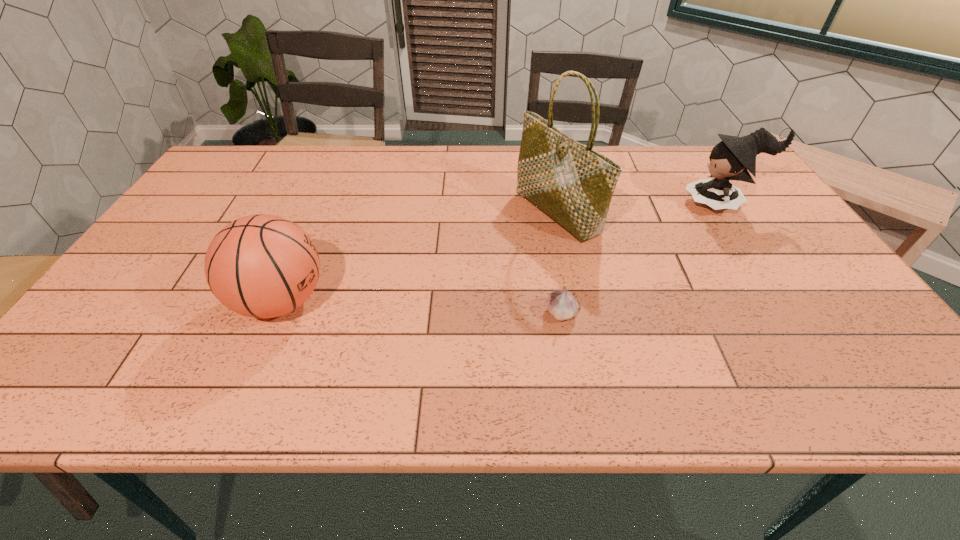
The height and width of the screenshot is (540, 960). Find the location of `free space between the shortest object and the tallest object`. free space between the shortest object and the tallest object is located at coordinates (559, 262).

This screenshot has width=960, height=540. Find the location of `free spot between the shopping bag and the doll`. free spot between the shopping bag and the doll is located at coordinates (639, 208).

This screenshot has height=540, width=960. Identify the location of vacant area that lies between the shortest object and the leftmost object. (421, 307).

Locate an element on the screen. free space between the tallest object and the doll is located at coordinates click(x=639, y=208).

I want to click on free space between the shopping bag and the basketball, so click(419, 257).

Where is `object that stands as the third closest to the rightmost object`? object that stands as the third closest to the rightmost object is located at coordinates (262, 266).

Where is `the second closest object to the shopping bag`? The image size is (960, 540). the second closest object to the shopping bag is located at coordinates point(731,159).

The width and height of the screenshot is (960, 540). I want to click on free space that satisfies the following two spatial constraints: 1. on the surface of the garlic near the brand logo; 2. on the right side of the basketball, so click(x=276, y=312).

Find the location of `free space that satisfies the following two spatial constraints: 1. on the surface of the basketball near the brand logo; 2. on the right side of the garlic`. free space that satisfies the following two spatial constraints: 1. on the surface of the basketball near the brand logo; 2. on the right side of the garlic is located at coordinates (276, 312).

This screenshot has width=960, height=540. I want to click on blank space that satisfies the following two spatial constraints: 1. on the surface of the leftmost object near the brand logo; 2. on the right side of the shortest object, so click(x=276, y=312).